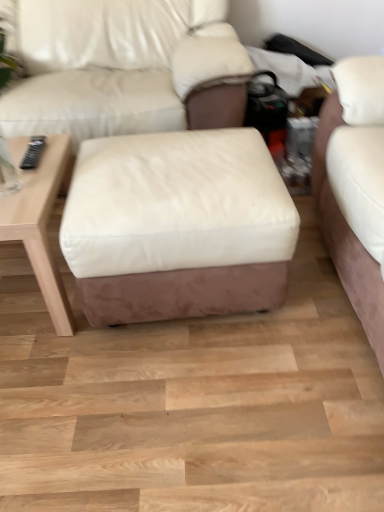
You are a GUI agent. You are given a task and a screenshot of the screen. Output one action in this format:
    pyautogui.click(x=<x>, y=<y>)
    Task: Click on the vacant space situated above white leather ottoman at center (from a real-world perspective)
    Image resolution: width=384 pixels, height=512 pixels.
    Given the screenshot: What is the action you would take?
    pyautogui.click(x=179, y=164)